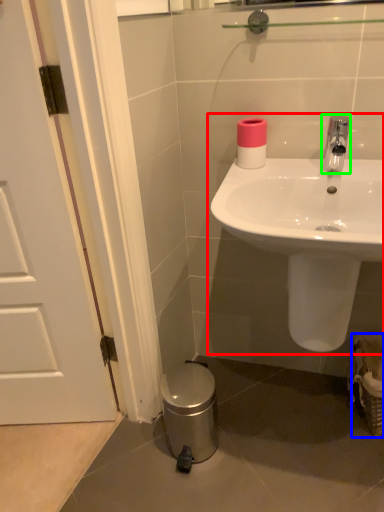
Question: Estimate the real-world distances between objects in this image. Which object is closer to sink (highlighted by a red box), basket (highlighted by a blue box) or tap (highlighted by a green box)?

Choices:
 (A) basket
 (B) tap

Answer: (B)